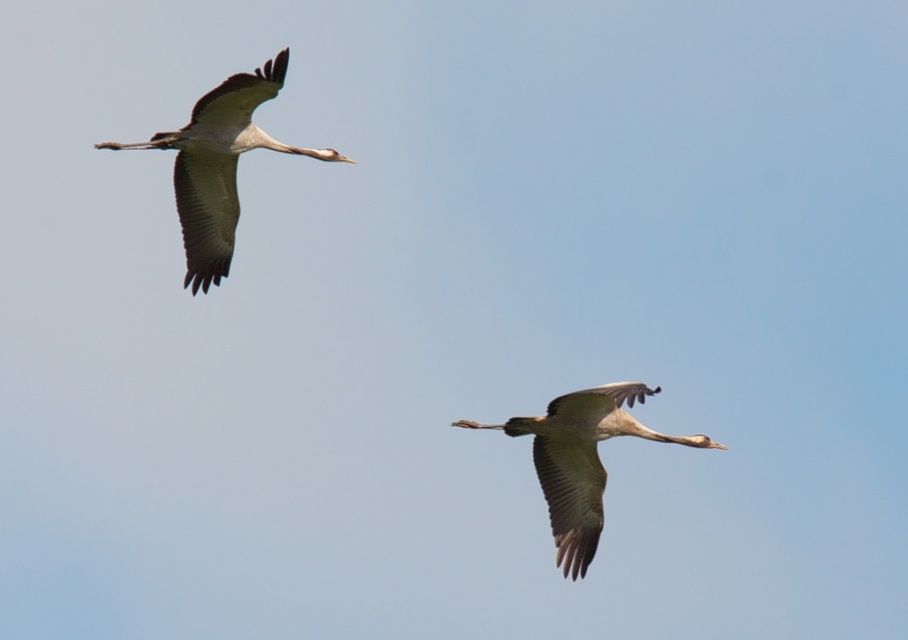
Question: Can you confirm if gray matte bird at upper left is wider than gray feathered crane at center?

Choices:
 (A) yes
 (B) no

Answer: (A)

Question: Can you confirm if gray matte bird at upper left is positioned to the left of gray feathered crane at center?

Choices:
 (A) no
 (B) yes

Answer: (B)

Question: Does gray matte bird at upper left have a lesser width compared to gray feathered crane at center?

Choices:
 (A) yes
 (B) no

Answer: (B)

Question: Among these objects, which one is farthest from the camera?

Choices:
 (A) gray matte bird at upper left
 (B) gray feathered crane at center

Answer: (A)

Question: Which point is farther from the camera taking this photo?

Choices:
 (A) (201, 144)
 (B) (620, 429)

Answer: (A)